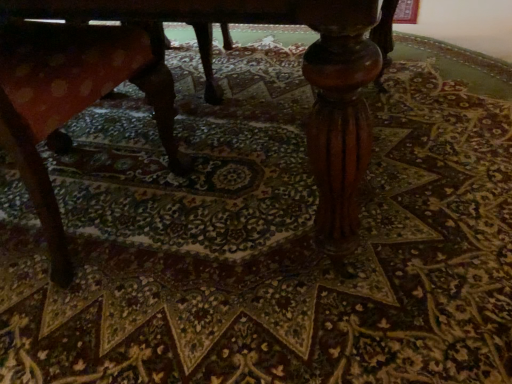
Question: Would you say wooden textured rocking chair at left is to the left or to the right of wooden table at center in the picture?

Choices:
 (A) left
 (B) right

Answer: (A)

Question: Is wooden textured rocking chair at left taller or shorter than wooden table at center?

Choices:
 (A) short
 (B) tall

Answer: (A)

Question: From the image's perspective, is wooden textured rocking chair at left positioned above or below wooden table at center?

Choices:
 (A) below
 (B) above

Answer: (A)

Question: Relative to wooden textured rocking chair at left, is wooden table at center in front or behind?

Choices:
 (A) behind
 (B) front

Answer: (B)

Question: From the image's perspective, is wooden table at center located above or below wooden textured rocking chair at left?

Choices:
 (A) below
 (B) above

Answer: (B)

Question: From a real-world perspective, is wooden table at center above or below wooden textured rocking chair at left?

Choices:
 (A) above
 (B) below

Answer: (A)

Question: Is wooden table at center wider or thinner than wooden textured rocking chair at left?

Choices:
 (A) thin
 (B) wide

Answer: (B)